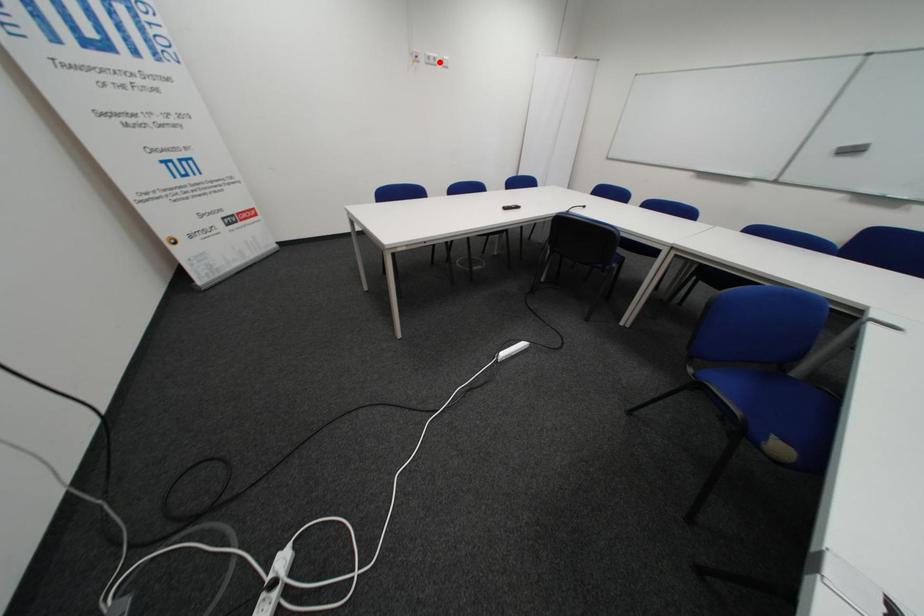
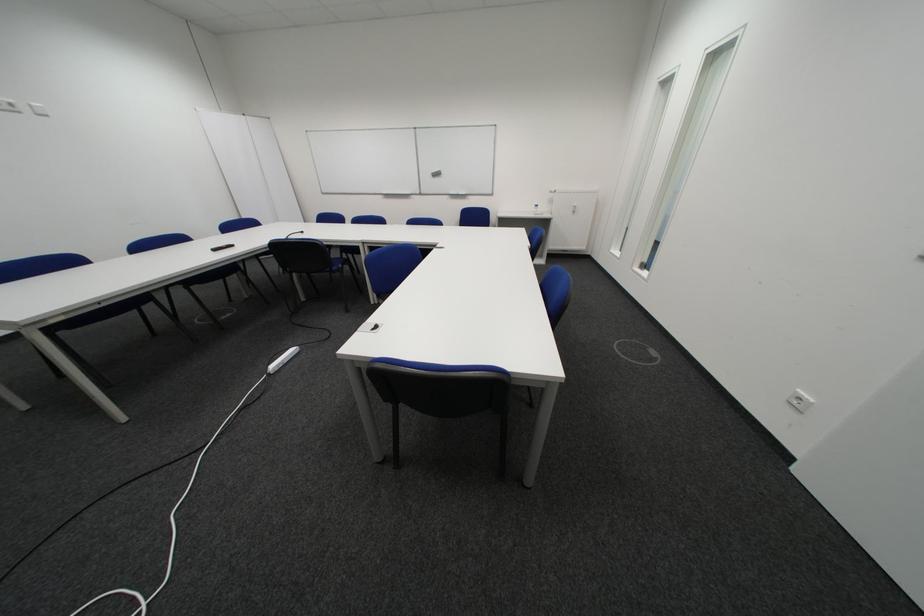
Locate, in the second image, the point that corresponds to the highlighted location in the first image.

(8, 108)